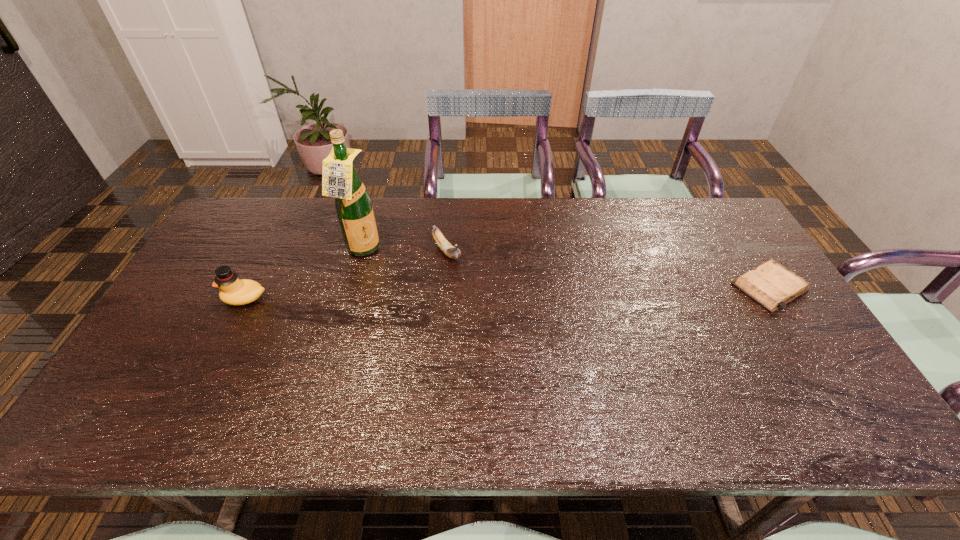
At what (x,y) coordinates should I click in order to perform the action: click on the leftmost object. Please return your answer as a coordinate pair (x, y). Looking at the image, I should click on coord(233,291).

Locate an element on the screen. Image resolution: width=960 pixels, height=540 pixels. the second tallest object is located at coordinates (233, 291).

Identify the location of the rightmost object. This screenshot has height=540, width=960. click(771, 285).

Where is `the shortest object`? The width and height of the screenshot is (960, 540). the shortest object is located at coordinates (771, 285).

What are the coordinates of `banana` in the screenshot? It's located at [x=452, y=252].

You are a GUI agent. You are given a task and a screenshot of the screen. Output one action in this format:
    pyautogui.click(x=<x>, y=<y>)
    Task: Click on the second shortest object
    
    Given the screenshot: What is the action you would take?
    pyautogui.click(x=452, y=252)

Where is `the third object from right to left`? the third object from right to left is located at coordinates (340, 180).

This screenshot has height=540, width=960. In order to click on the tallest object in this screenshot , I will do coord(340,180).

Where is `free space located on the front-facing side of the leftmost object`? Image resolution: width=960 pixels, height=540 pixels. free space located on the front-facing side of the leftmost object is located at coordinates (179, 298).

Image resolution: width=960 pixels, height=540 pixels. What are the coordinates of `vacant area situated on the front-facing side of the leftmost object` in the screenshot? It's located at (200, 298).